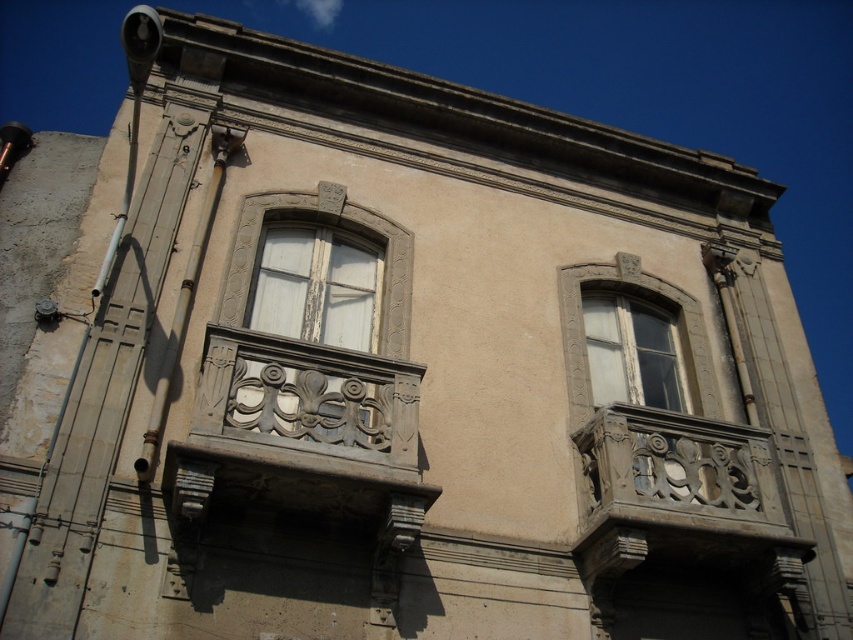
Describe the element at coordinates (316, 288) in the screenshot. The image size is (853, 640). I see `white wood window at center` at that location.

Where is `white wood window at center`? This screenshot has width=853, height=640. white wood window at center is located at coordinates (316, 288).

I want to click on carved stone balcony at center, so pyautogui.click(x=302, y=433).

Between point (281, 438) and point (636, 349), which one is positioned behind?

The point (636, 349) is more distant.

I want to click on carved stone balcony at center, so click(302, 433).

Is carved stone balcony at center smaller than white wood window at center?

Incorrect, carved stone balcony at center is not smaller in size than white wood window at center.

Is carved stone balcony at center taller than white wood window at center?

Yes.

Is point (358, 454) in front of point (281, 332)?

That is True.

Locate an element on the screen. Image resolution: width=853 pixels, height=640 pixels. carved stone balcony at center is located at coordinates (302, 433).